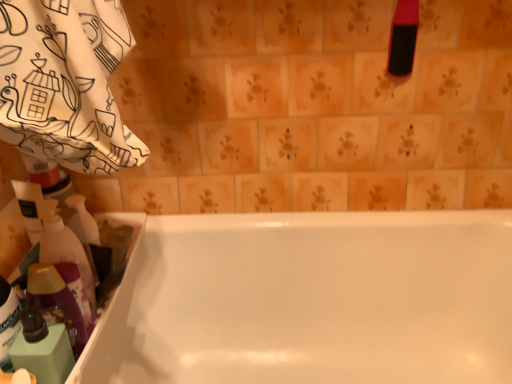
Question: In terms of height, does pink rubber brush at upper right, which appears as the 1th cleaning product when viewed from the top, look taller or shorter compared to white glossy bathtub at center?

Choices:
 (A) tall
 (B) short

Answer: (B)

Question: Based on their sizes in the image, would you say pink rubber brush at upper right, which appears as the 1th cleaning product when viewed from the right, is bigger or smaller than white glossy bathtub at center?

Choices:
 (A) big
 (B) small

Answer: (B)

Question: Which object is the farthest from the translucent plastic bottle at left, marked as the second cleaning product in a right-to-left arrangement?

Choices:
 (A) pink rubber brush at upper right, which appears as the 1th cleaning product when viewed from the top
 (B) translucent plastic bottle at lower left, which is the 1th cleaning product in bottom-to-top order
 (C) white glossy bathtub at center

Answer: (A)

Question: Which object is positioned closest to the white glossy bathtub at center?

Choices:
 (A) translucent plastic bottle at lower left, placed as the 3th cleaning product when sorted from right to left
 (B) translucent plastic bottle at left, the second cleaning product positioned from the top
 (C) pink rubber brush at upper right, acting as the 3th cleaning product starting from the bottom

Answer: (B)